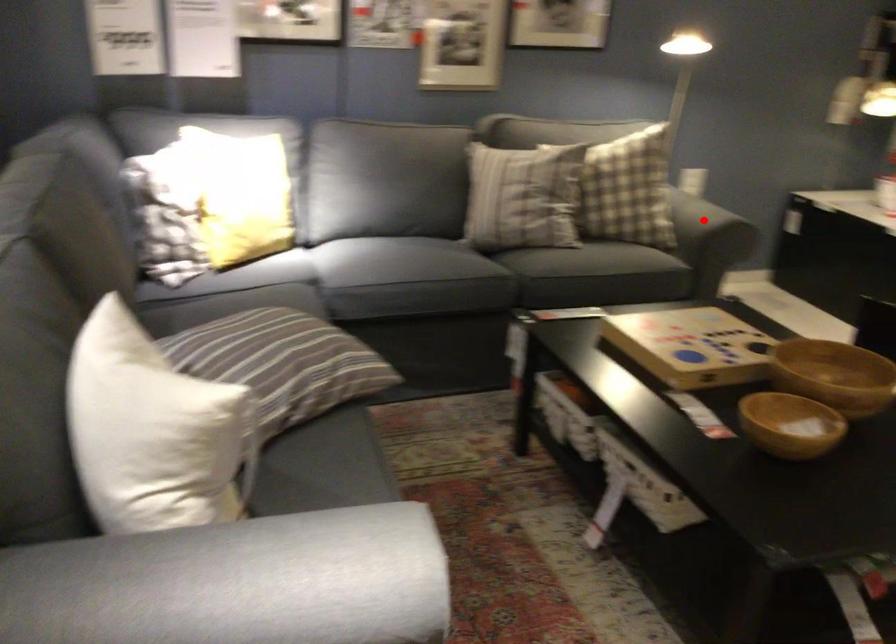
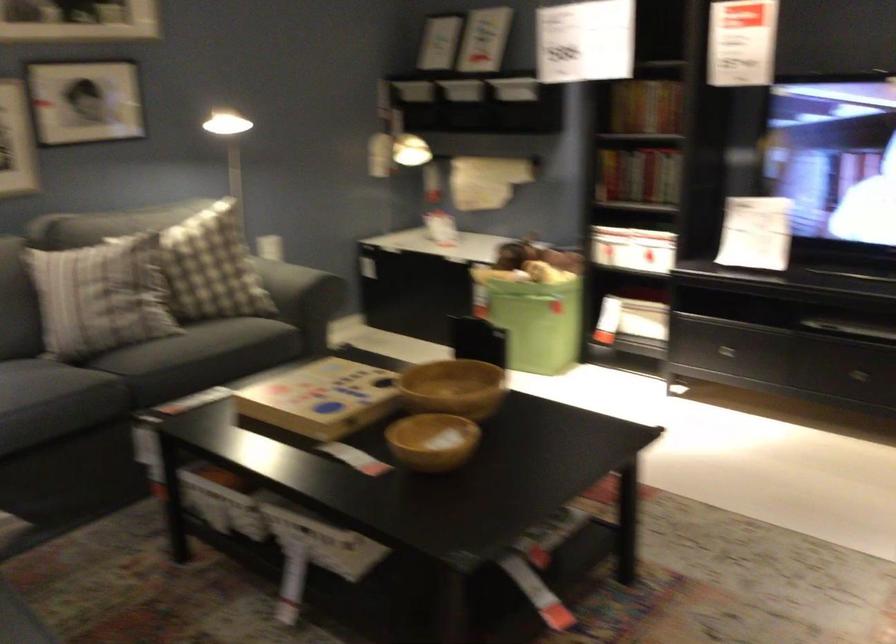
The point at the highlighted location is marked in the first image. Where is the corresponding point in the second image?

(286, 285)